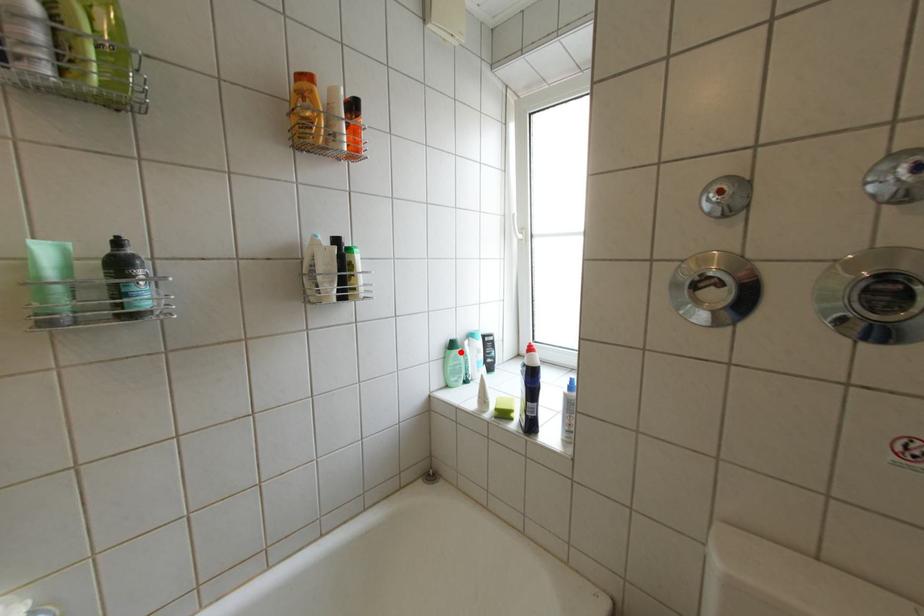
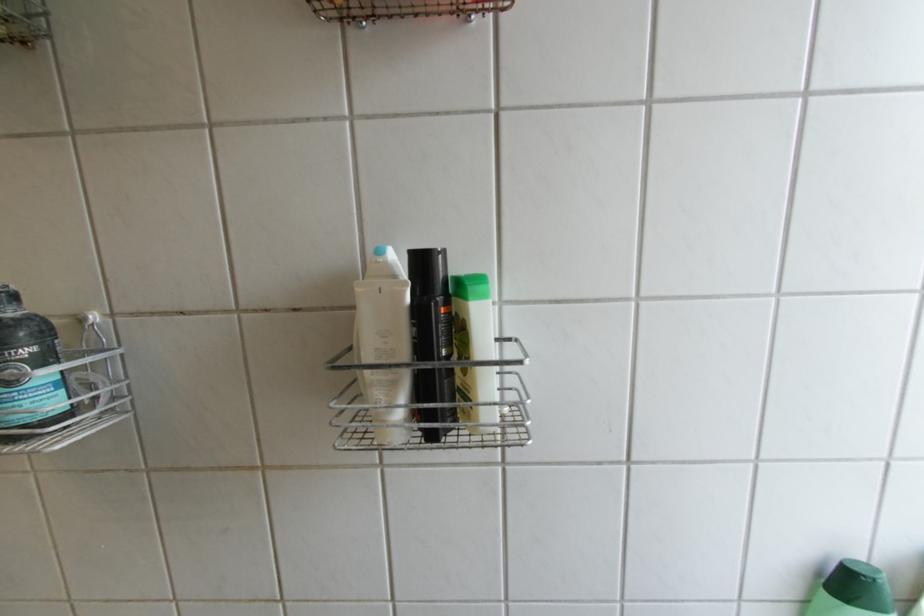
Locate, in the second image, the point that corresponds to the highlighted location in the first image.

(839, 596)